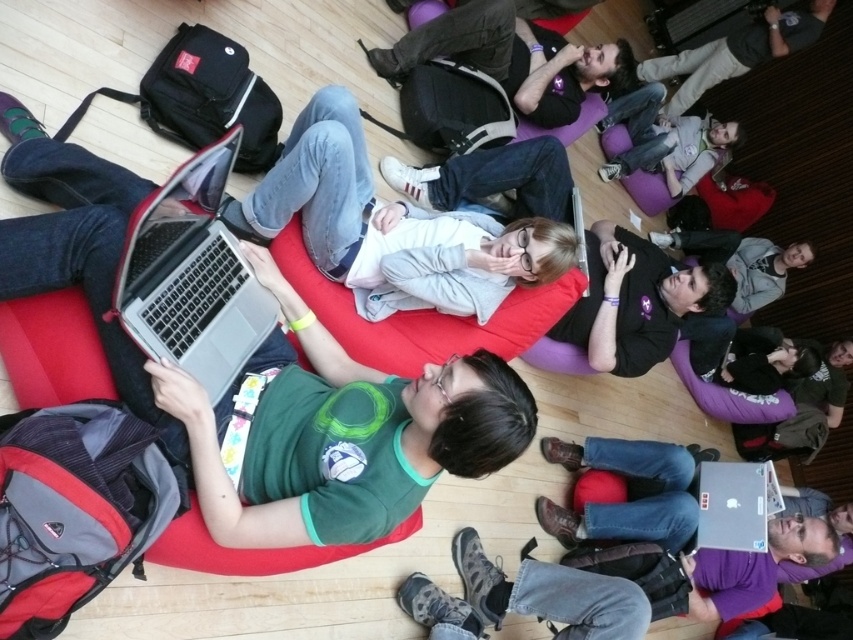
From the picture: You are a photographer setting up a tripod in this scene. You need to position it so that the matte black laptop at upper center is visible but not blocking the dark gray fabric jacket at upper right. Is this possible?

The matte black laptop at upper center is in front of the dark gray fabric jacket at upper right. Therefore, positioning the tripod so that the laptop is visible without blocking the jacket would require angling the camera to capture both, but since the laptop is already in front, it might still obscure the jacket unless moved or repositioned.

Looking at the scene, where is the matte gray sweater at center in relation to the silver metallic laptop at center?

The matte gray sweater at center is to the right of the silver metallic laptop at center.